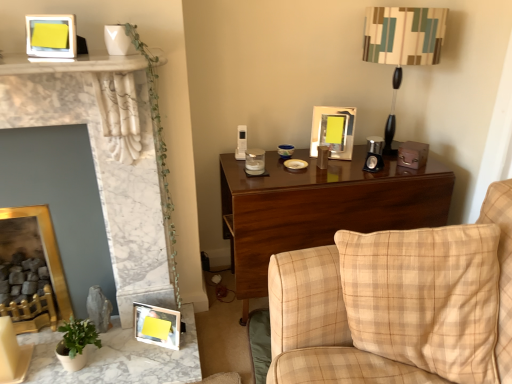
Where is `free space to the left of wooden photo frame at lower left, the fourth picture frame positioned from the top`? This screenshot has width=512, height=384. free space to the left of wooden photo frame at lower left, the fourth picture frame positioned from the top is located at coordinates (122, 339).